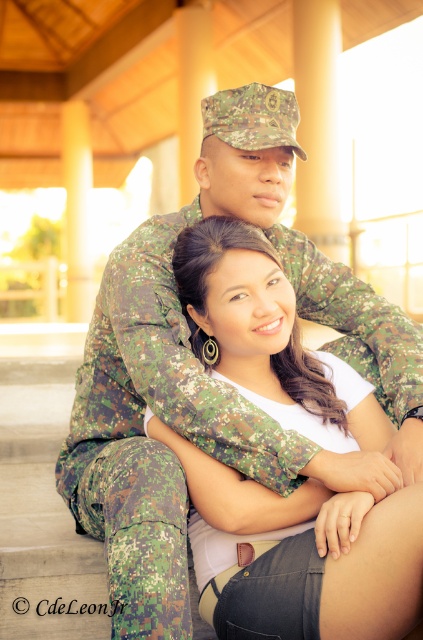
Based on the scene described, which object is positioned higher between the matte camouflage shirt at center and the camouflage fabric uniform at center?

The matte camouflage shirt at center is positioned higher than the camouflage fabric uniform at center.

You are an observer standing in front of the wooden structure. You notice two people sitting closely. The person on the left is wearing a matte camouflage shirt at center, and the other is wearing a camouflage fabric uniform at center. Which clothing item is positioned to the right?

The matte camouflage shirt at center is positioned to the right of the camouflage fabric uniform at center.